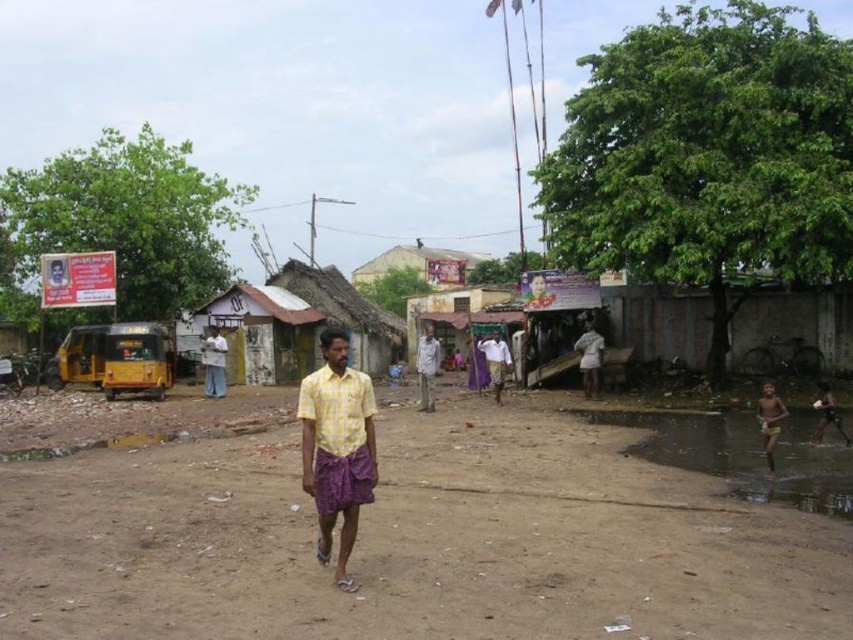
Question: Can you confirm if white corrugated metal hut at center is wider than white cotton shirt at center?

Choices:
 (A) no
 (B) yes

Answer: (B)

Question: In this image, where is light blue fabric shirt at center located relative to white cotton shirt at center?

Choices:
 (A) left
 (B) right

Answer: (B)

Question: Estimate the real-world distances between objects in this image. Which object is closer to the yellow corrugated metal hut at center?

Choices:
 (A) yellow skin at lower right
 (B) white cotton shirt at center

Answer: (B)

Question: Which object is the closest to the yellowish sand at lower right?

Choices:
 (A) light blue fabric shirt at center
 (B) yellow/yellowish fabric shirt at center

Answer: (A)

Question: Can you confirm if yellow corrugated metal hut at center is positioned to the right of yellow/yellowish fabric shirt at center?

Choices:
 (A) yes
 (B) no

Answer: (B)

Question: Considering the real-world distances, which object is farthest from the yellow skin at lower right?

Choices:
 (A) white corrugated metal hut at center
 (B) white cotton shirt at center
 (C) light brown skin at lower right

Answer: (A)